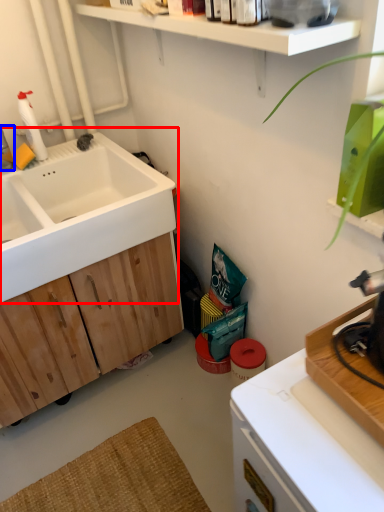
Question: Which object appears closest to the camera in this image, sink (highlighted by a red box) or faucet (highlighted by a blue box)?

Choices:
 (A) sink
 (B) faucet

Answer: (A)